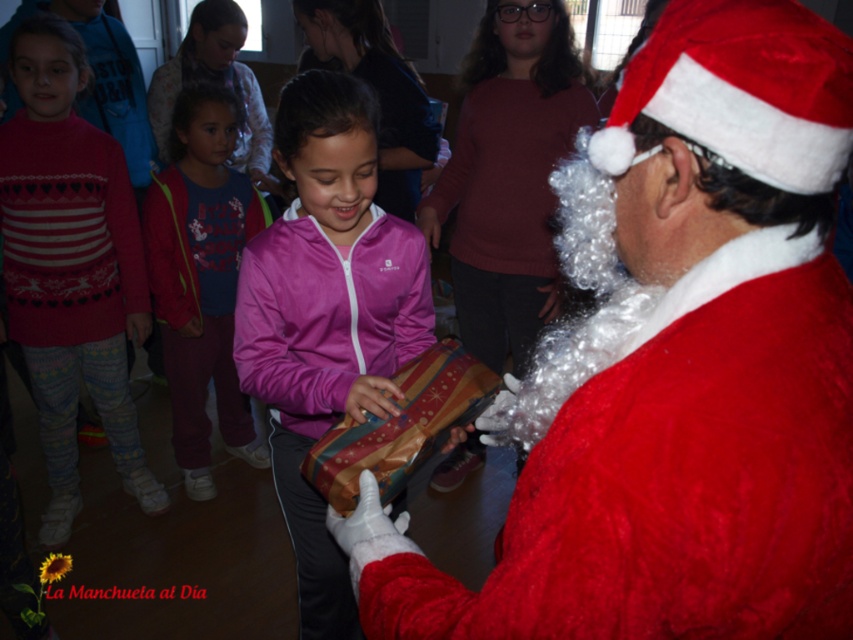
You are a toy delivery robot that is 10 inches wide. You need to move from the knitted sweater at left to the matte pink jacket at center. Can you fit through the space between them?

The distance between the knitted sweater at left and the matte pink jacket at center is 10.56 inches. Since the robot is 10 inches wide, it can fit through the space as there is enough clearance.

You are a gift delivery robot that is 1 meter wide. You need to move from the knitted sweater at left to the pink fabric jacket at center to deliver a gift. Can you fit through the space between them?

The pink fabric jacket at center and knitted sweater at left are 1.18 meters apart, so the robot can fit through the space between them since it is wider than the robot.

You are a photographer standing in the scene and want to take a photo of the velvet red santa claus at center. If your camera has a focal length of 50mm and the recommended distance for clear photos is 18 inches, is the current distance sufficient?

The velvet red santa claus at center and viewer are 17.39 inches apart, which is slightly less than the recommended 18 inches. Therefore, the current distance is insufficient for a clear photo.